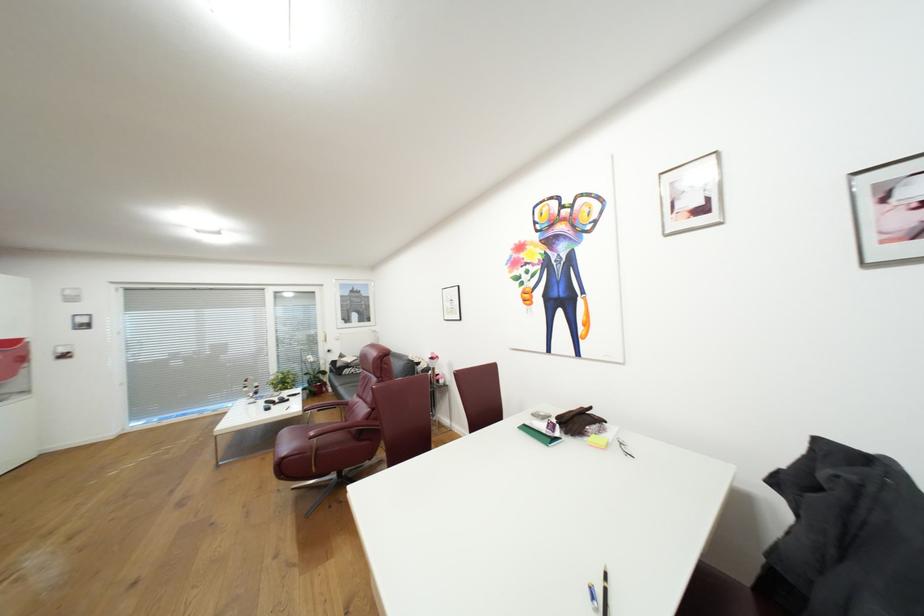
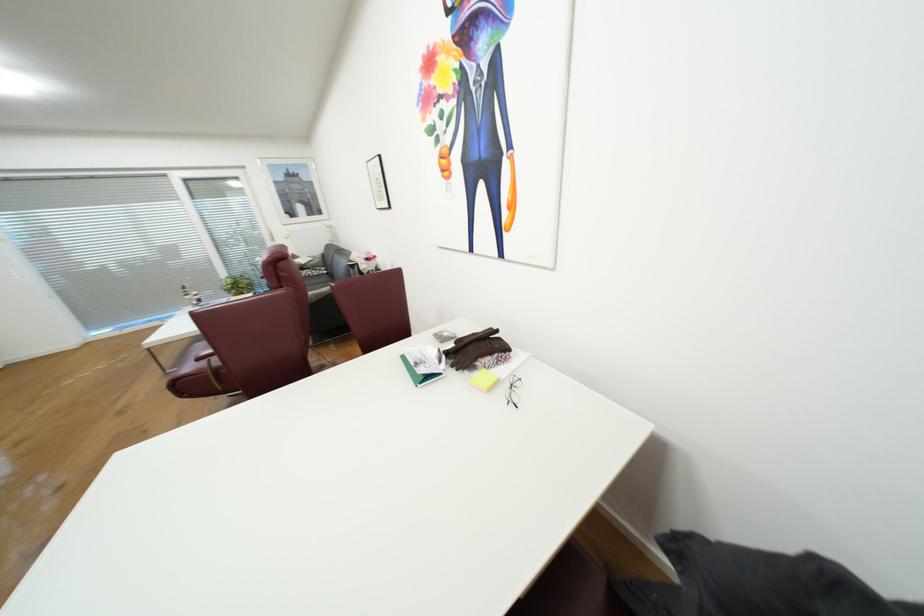
In the second image, find the point that corresponds to pixel 318 438 in the first image.

(205, 360)